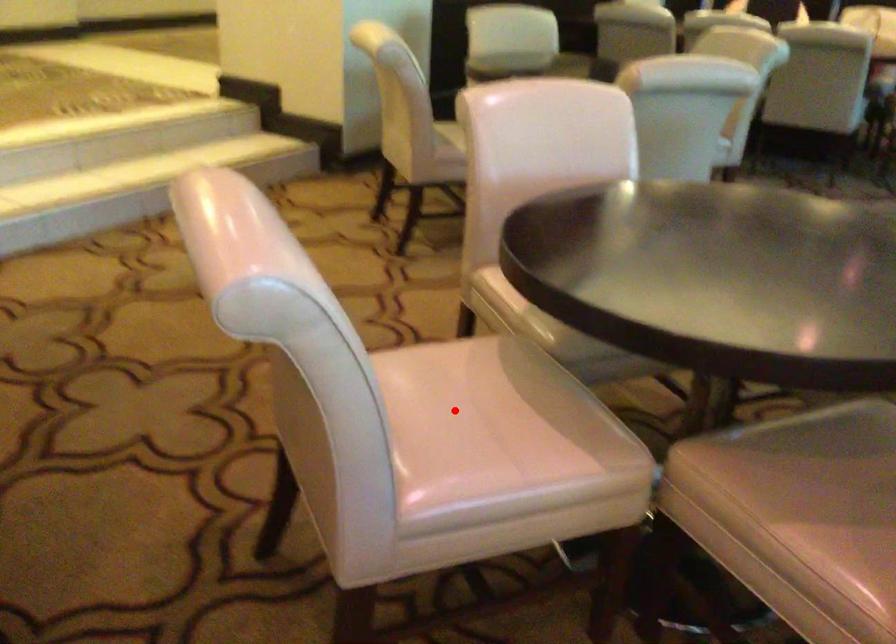
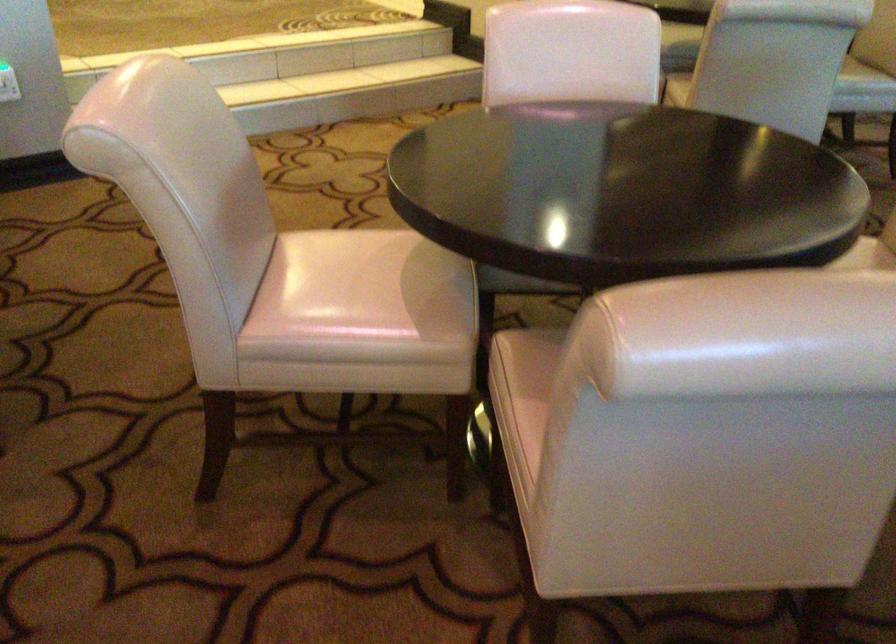
Question: I am providing you with two images of the same scene from different viewpoints. Image1 has a red point marked. In image2, the corresponding 3D location appears at what relative position? Reply with the corresponding letter.

Choices:
 (A) Closer
 (B) Farther

Answer: (B)